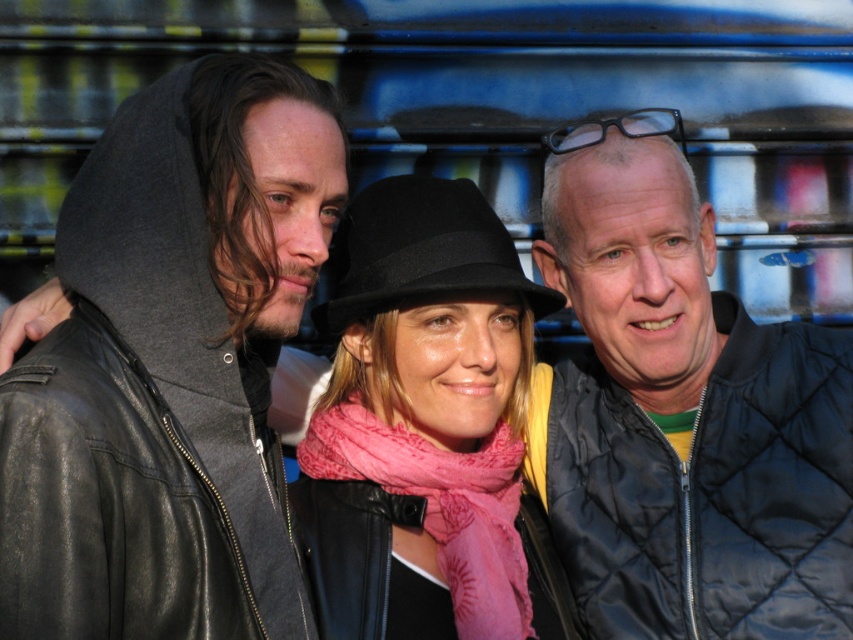
Can you confirm if quilted black jacket at right is positioned to the right of pink fabric scarf at center?

Indeed, quilted black jacket at right is positioned on the right side of pink fabric scarf at center.

Find the location of `quilted black jacket at right`. quilted black jacket at right is located at coordinates (683, 417).

Is point (318, 538) positioned before point (474, 266)?

No, (318, 538) is further to viewer.

Is point (490, 326) less distant than point (451, 278)?

No.

The height and width of the screenshot is (640, 853). I want to click on pink fabric scarf at center, so click(x=422, y=417).

Which is more to the right, leather jacket at left or quilted black jacket at right?

quilted black jacket at right

Describe the element at coordinates (171, 368) in the screenshot. I see `leather jacket at left` at that location.

Identify the location of leather jacket at left. (171, 368).